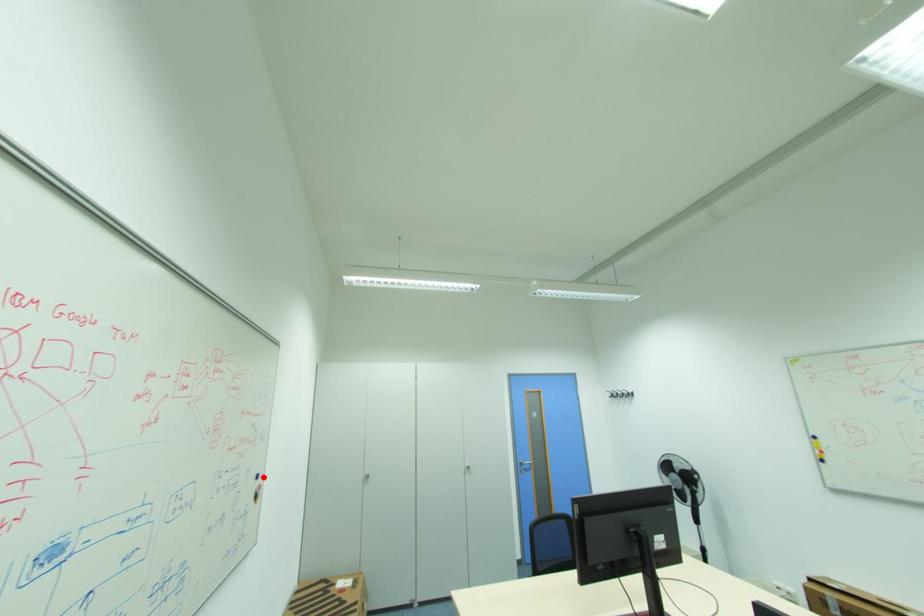
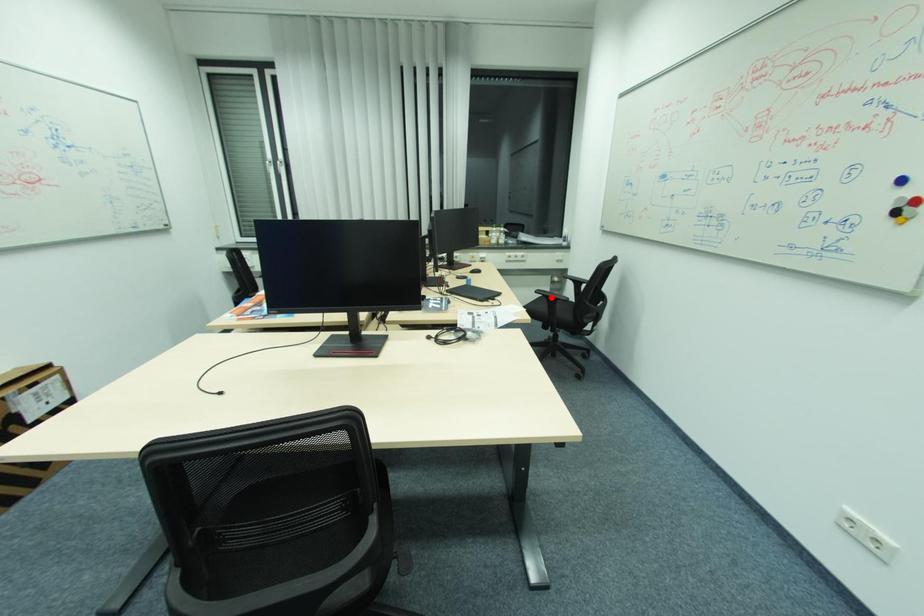
I am providing you with two images of the same scene from different viewpoints. A red point is marked on the first image and another point is marked on the second image. Do the highlighted points in image1 and image2 indicate the same real-world spot?

No